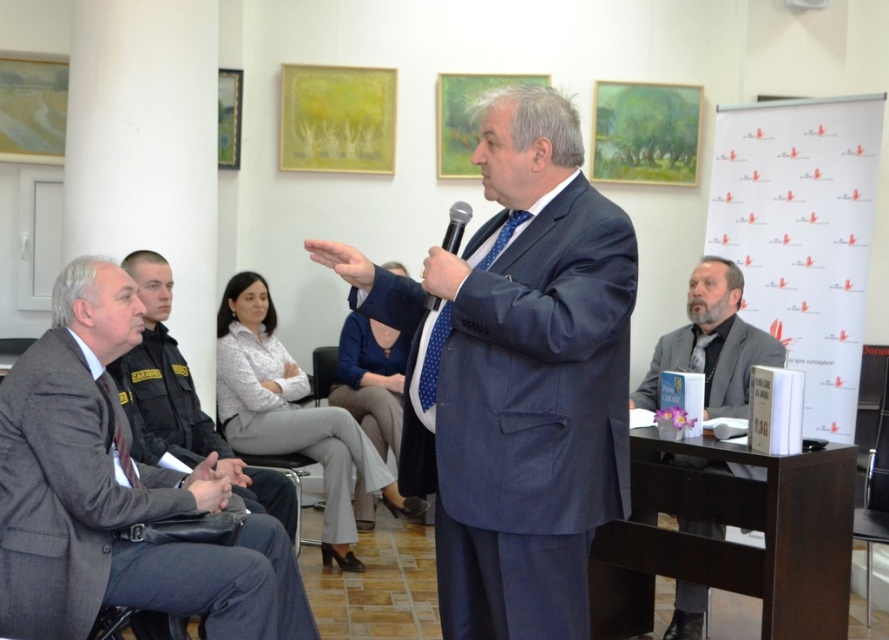
You are a tailor measuring the distance between two suits in a crowded room. The gray wool suit at left and the dark gray suit at left are both on display. Can you fit a 20 inch wide measuring tape between them?

The gray wool suit at left and the dark gray suit at left are 23.37 inches apart from each other, so yes, the 20 inch wide measuring tape can fit between them since the distance is greater than the tape width.

You are standing in the room and want to locate the gray wool suit at left. According to the coordinates provided, where should you look?

You should look at point 0.772 on the x axis and 0.132 on the y axis to locate the gray wool suit at left.

You are an event planner organizing a presentation. You need to ensure that the gray wool suit at left and the black plastic microphone at center are visible to the audience. Based on their positions, which object is closer to the audience?

The gray wool suit at left is below the black plastic microphone at center, so the microphone is closer to the audience than the suit.